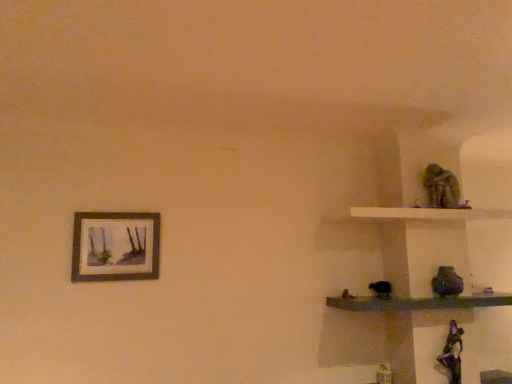
Question: Should I look upward or downward to see matte wooden picture frame at upper left?

Choices:
 (A) down
 (B) up

Answer: (A)

Question: Would you consider smooth dark wood shelf at right, the second shelf when ordered from top to bottom, to be distant from matte wooden picture frame at upper left?

Choices:
 (A) no
 (B) yes

Answer: (B)

Question: Is smooth dark wood shelf at right, placed as the 1th shelf when sorted from bottom to top, surrounding matte wooden picture frame at upper left?

Choices:
 (A) yes
 (B) no

Answer: (B)

Question: Is smooth dark wood shelf at right, the second shelf when ordered from top to bottom, oriented away from matte wooden picture frame at upper left?

Choices:
 (A) no
 (B) yes

Answer: (A)

Question: Is smooth dark wood shelf at right, placed as the 1th shelf when sorted from bottom to top, with matte wooden picture frame at upper left?

Choices:
 (A) no
 (B) yes

Answer: (A)

Question: Is the position of smooth dark wood shelf at right, the second shelf when ordered from top to bottom, less distant than that of matte wooden picture frame at upper left?

Choices:
 (A) yes
 (B) no

Answer: (A)

Question: Is smooth dark wood shelf at right, placed as the 1th shelf when sorted from bottom to top, at the left side of matte wooden picture frame at upper left?

Choices:
 (A) no
 (B) yes

Answer: (A)

Question: Is matte wooden picture frame at upper left shorter than green mossy statue at upper right?

Choices:
 (A) no
 (B) yes

Answer: (A)

Question: From the image's perspective, does matte wooden picture frame at upper left appear lower than green mossy statue at upper right?

Choices:
 (A) yes
 (B) no

Answer: (A)

Question: Is matte wooden picture frame at upper left far away from green mossy statue at upper right?

Choices:
 (A) yes
 (B) no

Answer: (A)

Question: Can you confirm if matte wooden picture frame at upper left is bigger than green mossy statue at upper right?

Choices:
 (A) no
 (B) yes

Answer: (A)

Question: Can you confirm if matte wooden picture frame at upper left is positioned to the left of green mossy statue at upper right?

Choices:
 (A) no
 (B) yes

Answer: (B)

Question: Is matte wooden picture frame at upper left to the right of green mossy statue at upper right from the viewer's perspective?

Choices:
 (A) yes
 (B) no

Answer: (B)

Question: From a real-world perspective, is green mossy statue at upper right on white matte shelf at upper right, which appears as the 1th shelf when viewed from the top?

Choices:
 (A) no
 (B) yes

Answer: (B)